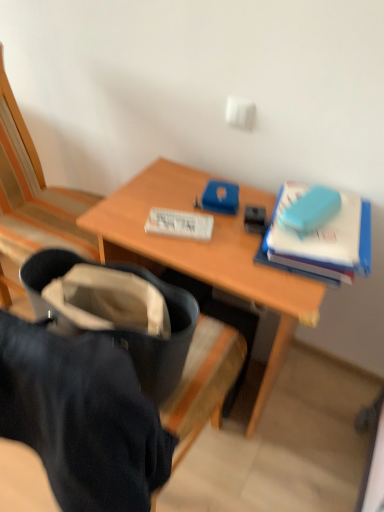
This screenshot has width=384, height=512. I want to click on free space to the right of white paper at center, placed as the first paperback book when sorted from left to right, so click(243, 233).